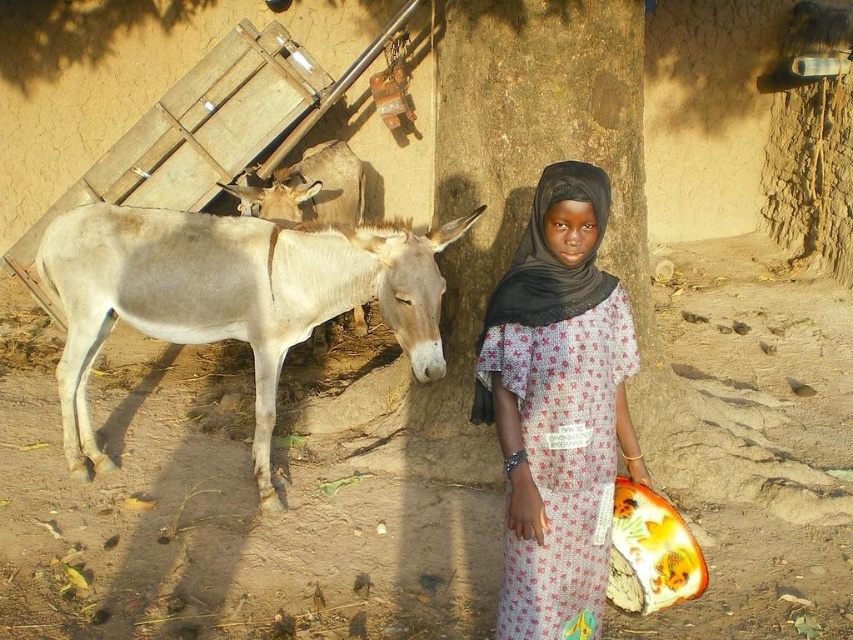
Question: Is brown dirt field at center behind light gray smooth mule at left?

Choices:
 (A) yes
 (B) no

Answer: (A)

Question: Which point is closer to the camera?

Choices:
 (A) printed cotton dress at center
 (B) brown dirt field at center

Answer: (A)

Question: Does brown dirt field at center have a larger size compared to white matte mule at center?

Choices:
 (A) no
 (B) yes

Answer: (A)

Question: Which of these objects is positioned closest to the printed cotton dress at center?

Choices:
 (A) light gray smooth mule at left
 (B) white matte mule at center

Answer: (A)

Question: Which of the following is the closest to the observer?

Choices:
 (A) (352, 212)
 (B) (322, 532)

Answer: (B)

Question: Does light gray smooth mule at left have a lesser width compared to printed cotton dress at center?

Choices:
 (A) yes
 (B) no

Answer: (B)